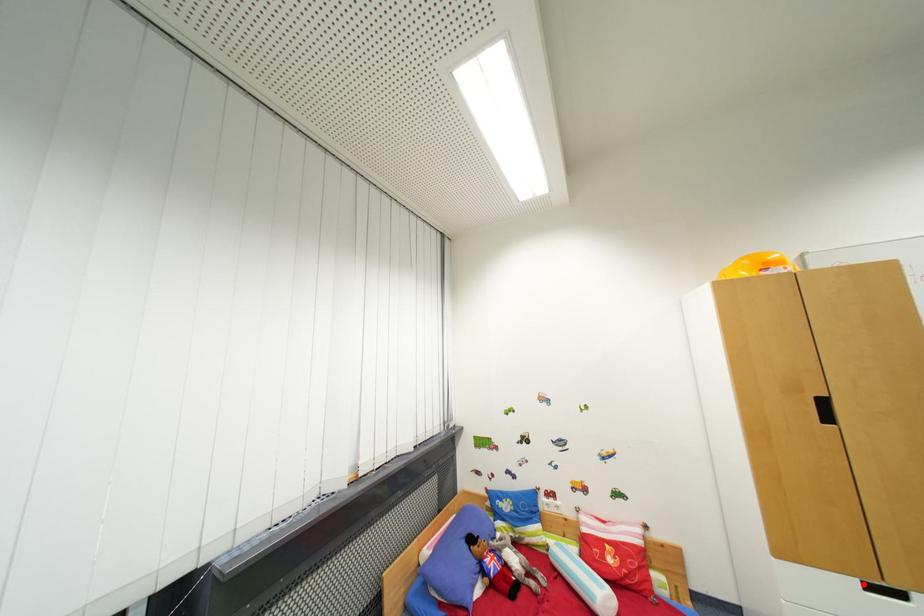
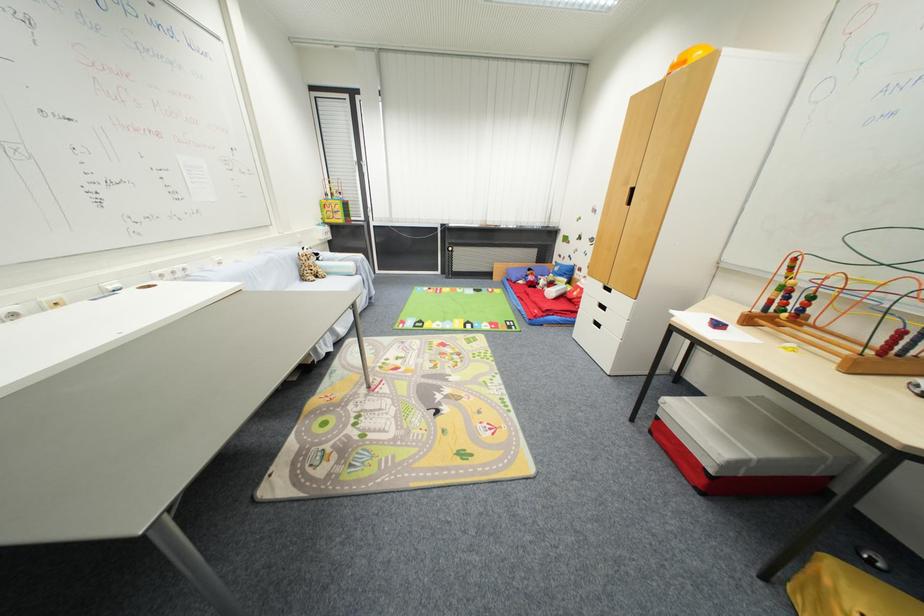
Question: A red point is marked in image1. In image2, is the corresponding 3D point closer to the camera or farther? Reply with the corresponding letter.

Choices:
 (A) The corresponding 3D point is closer.
 (B) The corresponding 3D point is farther.

Answer: (B)